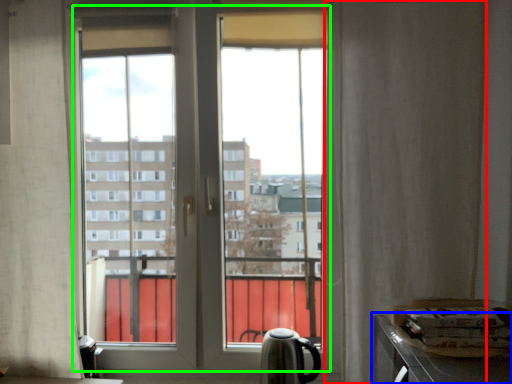
Question: Estimate the real-world distances between objects in this image. Which object is farther from curtain (highlighted by a red box), counter top (highlighted by a blue box) or bay window (highlighted by a green box)?

Choices:
 (A) counter top
 (B) bay window

Answer: (B)